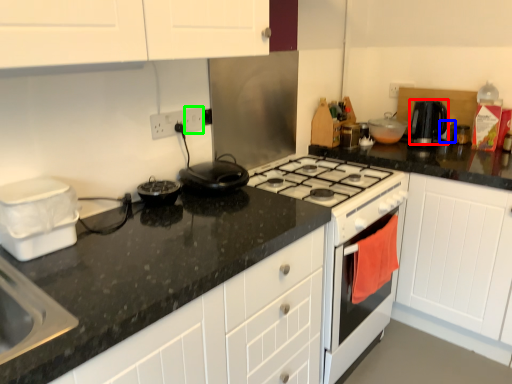
Question: Considering the real-world distances, which object is farthest from kitchen appliance (highlighted by a red box)? appliance (highlighted by a blue box) or electric outlet (highlighted by a green box)?

Choices:
 (A) appliance
 (B) electric outlet

Answer: (B)